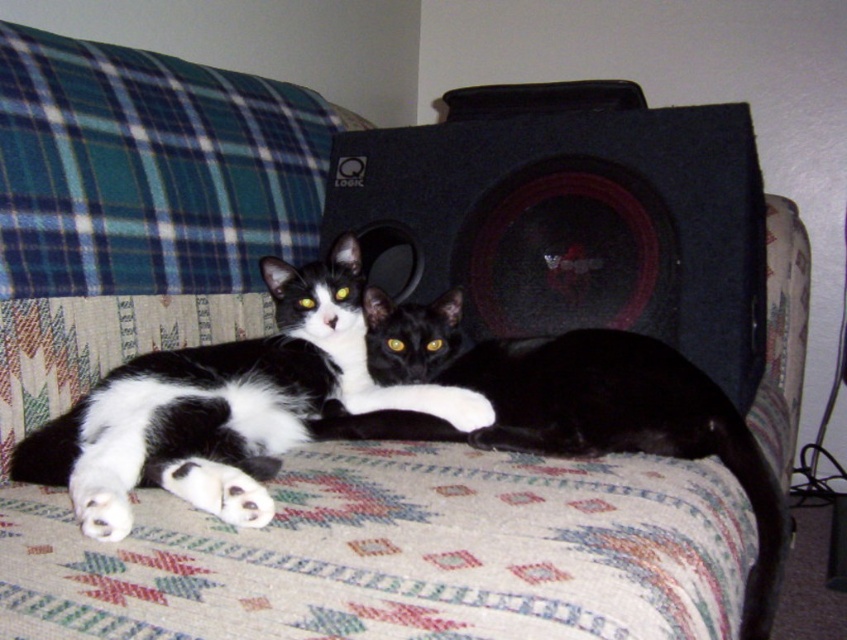
Question: Can you confirm if black and white fur cat at center is wider than black glossy cat at center?

Choices:
 (A) yes
 (B) no

Answer: (B)

Question: Which point is farther to the camera?

Choices:
 (A) (236, 404)
 (B) (533, 285)

Answer: (B)

Question: Can you confirm if black matte speaker at center is bigger than black glossy cat at center?

Choices:
 (A) yes
 (B) no

Answer: (A)

Question: Is black matte speaker at center bigger than black and white fur cat at center?

Choices:
 (A) no
 (B) yes

Answer: (B)

Question: Which object appears closest to the camera in this image?

Choices:
 (A) black and white fur cat at center
 (B) black glossy cat at center

Answer: (A)

Question: Which of the following is the farthest from the observer?

Choices:
 (A) black glossy cat at center
 (B) black and white fur cat at center
 (C) black matte speaker at center

Answer: (C)